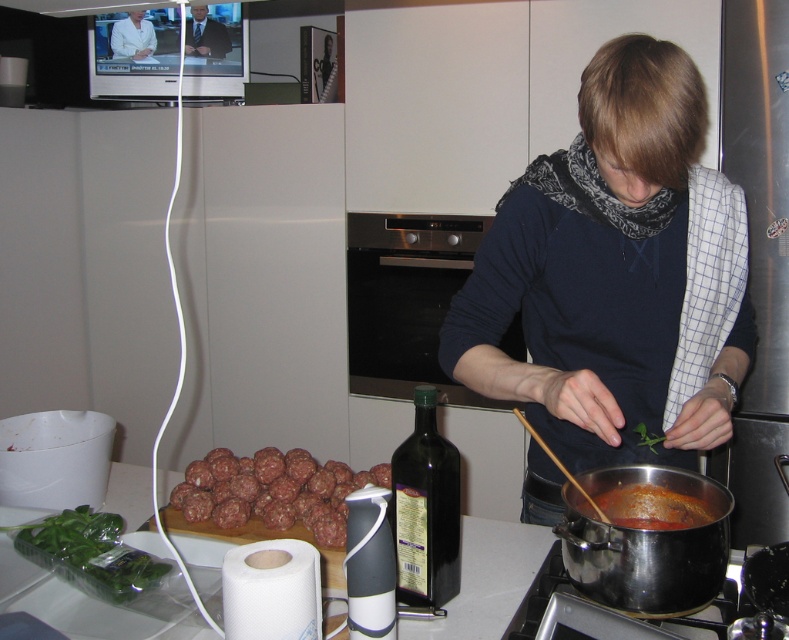
Based on the photo, you are a chef who needs to place the brown meatballs at lower left and the green glass bottle at center on a shelf. The shelf has a height limit of 10 cm. Can both items fit vertically without exceeding the height limit?

The brown meatballs at lower left is shorter than the green glass bottle at center. Since the shelf has a height limit of 10 cm, both items can fit vertically as long as the tallest item, the green glass bottle at center, is under 10 cm. However, the exact heights are not provided, so we cannot confirm for certain.

You are a chef in a modern kitchen. You need to place a new spice jar between the red matte sauce at lower center and the white smooth coat at upper left. Based on their positions, which object should the spice jar be closer to?

The red matte sauce at lower center is positioned on the right side of white smooth coat at upper left, so the spice jar should be placed closer to the white smooth coat at upper left to maintain the left alignment.

You are organizing the kitchen counter and need to place the dark blue sweater at center and the green glass bottle at center. According to the scene, which item is positioned to the right of the other?

The dark blue sweater at center is to the right of the green glass bottle at center.